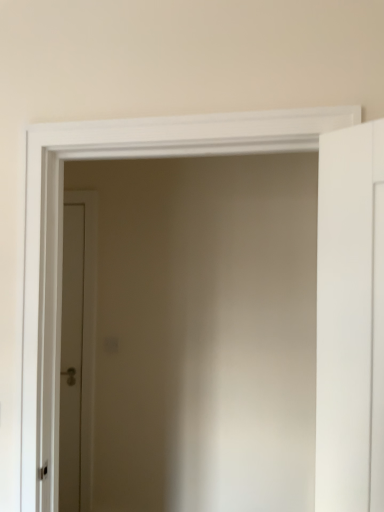
Question: Should I look upward or downward to see brown matte door at center, marked as the 1th door in a left-to-right arrangement?

Choices:
 (A) up
 (B) down

Answer: (B)

Question: Can you confirm if brown matte door at center, marked as the 2th door in a front-to-back arrangement, is smaller than white matte door at right, arranged as the 2th door when viewed from the back?

Choices:
 (A) no
 (B) yes

Answer: (A)

Question: Is brown matte door at center, the second door from the right, oriented away from white matte door at right, the second door from the left?

Choices:
 (A) no
 (B) yes

Answer: (A)

Question: From a real-world perspective, is brown matte door at center, positioned as the first door in back-to-front order, under white matte door at right, arranged as the 2th door when viewed from the back?

Choices:
 (A) no
 (B) yes

Answer: (B)

Question: Considering the relative positions of brown matte door at center, marked as the 1th door in a left-to-right arrangement, and white matte door at right, acting as the first door starting from the right, in the image provided, is brown matte door at center, marked as the 1th door in a left-to-right arrangement, to the right of white matte door at right, acting as the first door starting from the right, from the viewer's perspective?

Choices:
 (A) yes
 (B) no

Answer: (B)

Question: Does brown matte door at center, positioned as the first door in back-to-front order, lie in front of white matte door at right, the 1th door viewed from the front?

Choices:
 (A) yes
 (B) no

Answer: (B)

Question: Is brown matte door at center, the second door from the right, in contact with white matte door at right, the 1th door viewed from the front?

Choices:
 (A) yes
 (B) no

Answer: (B)

Question: Is white matte door at right, acting as the first door starting from the right, shorter than brown matte door at center, the second door from the right?

Choices:
 (A) yes
 (B) no

Answer: (A)

Question: From the image's perspective, would you say white matte door at right, the 1th door viewed from the front, is shown under brown matte door at center, positioned as the first door in back-to-front order?

Choices:
 (A) yes
 (B) no

Answer: (B)

Question: From a real-world perspective, is white matte door at right, arranged as the 2th door when viewed from the back, located higher than brown matte door at center, positioned as the first door in back-to-front order?

Choices:
 (A) no
 (B) yes

Answer: (B)

Question: Is white matte door at right, acting as the first door starting from the right, outside brown matte door at center, marked as the 2th door in a front-to-back arrangement?

Choices:
 (A) yes
 (B) no

Answer: (A)

Question: Does white matte door at right, arranged as the 2th door when viewed from the back, touch brown matte door at center, marked as the 2th door in a front-to-back arrangement?

Choices:
 (A) yes
 (B) no

Answer: (B)

Question: Can you confirm if white matte door at right, the second door from the left, is bigger than brown matte door at center, marked as the 1th door in a left-to-right arrangement?

Choices:
 (A) no
 (B) yes

Answer: (A)

Question: From the image's perspective, is brown matte door at center, the second door from the right, above or below white matte door at right, the 1th door viewed from the front?

Choices:
 (A) above
 (B) below

Answer: (B)